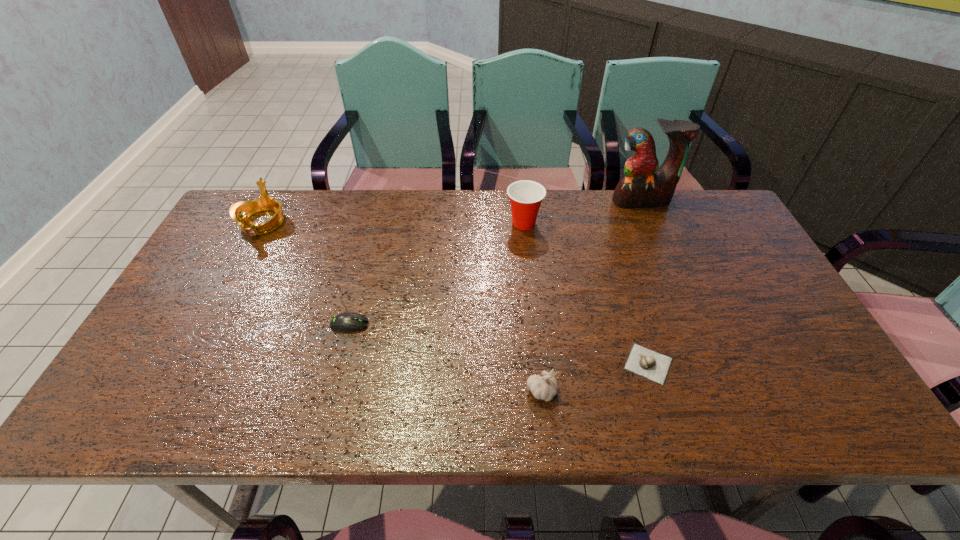
Identify the location of free space between the taller garlic and the parrot. (591, 296).

Identify which object is the second closest to the tiara. Please provide its 2D coordinates. Your answer should be formatted as a tuple, i.e. [(x, y)], where the tuple contains the x and y coordinates of a point satisfying the conditions above.

[(526, 196)]

Identify which object is located as the nearest to the fourth farthest object. Please provide its 2D coordinates. Your answer should be formatted as a tuple, i.e. [(x, y)], where the tuple contains the x and y coordinates of a point satisfying the conditions above.

[(240, 211)]

Locate an element on the screen. This screenshot has width=960, height=540. blank area in the image that satisfies the following two spatial constraints: 1. on the wheel side of the shortest object; 2. on the right side of the computer mouse is located at coordinates [x=340, y=364].

Locate an element on the screen. The image size is (960, 540). vacant space that satisfies the following two spatial constraints: 1. at the front emblem of the cup; 2. on the right side of the leftmost object is located at coordinates tap(262, 223).

At what (x,y) coordinates should I click in order to perform the action: click on blank space that satisfies the following two spatial constraints: 1. at the face of the parrot; 2. on the wheel side of the computer mouse. Please return your answer as a coordinate pair (x, y). Image resolution: width=960 pixels, height=540 pixels. Looking at the image, I should click on tap(693, 325).

Locate an element on the screen. The image size is (960, 540). vacant space that satisfies the following two spatial constraints: 1. on the wheel side of the computer mouse; 2. on the back side of the left garlic is located at coordinates (332, 391).